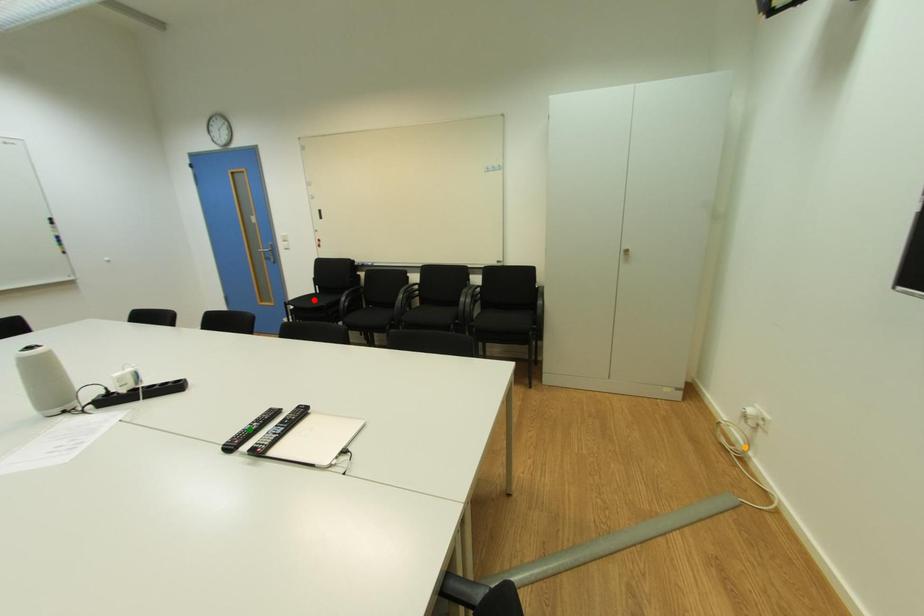
Order these from farthest to nearest:
1. green point
2. orange point
3. red point

1. red point
2. orange point
3. green point